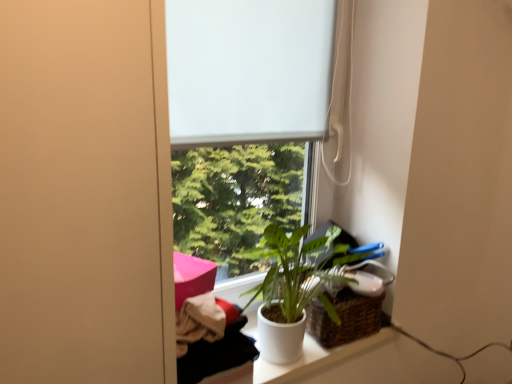
Question: Can you confirm if woven brown basket at lower right is smaller than white matte window screen at center?

Choices:
 (A) yes
 (B) no

Answer: (A)

Question: Considering the relative sizes of woven brown basket at lower right and white matte window screen at center in the image provided, is woven brown basket at lower right wider than white matte window screen at center?

Choices:
 (A) no
 (B) yes

Answer: (B)

Question: Is woven brown basket at lower right at the left side of white matte window screen at center?

Choices:
 (A) yes
 (B) no

Answer: (B)

Question: From a real-world perspective, is woven brown basket at lower right physically below white matte window screen at center?

Choices:
 (A) no
 (B) yes

Answer: (B)

Question: Does woven brown basket at lower right have a larger size compared to white matte window screen at center?

Choices:
 (A) no
 (B) yes

Answer: (A)

Question: Is woven brown basket at lower right oriented towards white matte window screen at center?

Choices:
 (A) yes
 (B) no

Answer: (B)

Question: Is white matte window at center at the right side of woven brown basket at lower right?

Choices:
 (A) yes
 (B) no

Answer: (B)

Question: From the image's perspective, would you say white matte window at center is shown under woven brown basket at lower right?

Choices:
 (A) yes
 (B) no

Answer: (B)

Question: Does white matte window at center have a greater height compared to woven brown basket at lower right?

Choices:
 (A) no
 (B) yes

Answer: (B)

Question: From the image's perspective, is white matte window at center over woven brown basket at lower right?

Choices:
 (A) no
 (B) yes

Answer: (B)

Question: Is white matte window at center at the left side of woven brown basket at lower right?

Choices:
 (A) no
 (B) yes

Answer: (B)

Question: From a real-world perspective, is white matte window at center physically above woven brown basket at lower right?

Choices:
 (A) yes
 (B) no

Answer: (A)

Question: Would you say white matte window at center is a long distance from white matte window screen at center?

Choices:
 (A) no
 (B) yes

Answer: (A)